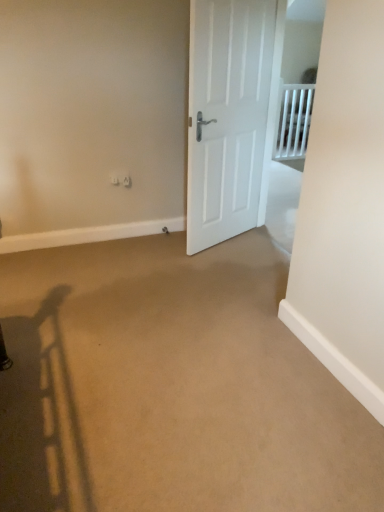
Locate an element on the screen. The width and height of the screenshot is (384, 512). white matte door at upper right is located at coordinates (231, 115).

Describe the element at coordinates (231, 115) in the screenshot. I see `white matte door at upper right` at that location.

Image resolution: width=384 pixels, height=512 pixels. In order to click on white matte door at upper right in this screenshot , I will do `click(231, 115)`.